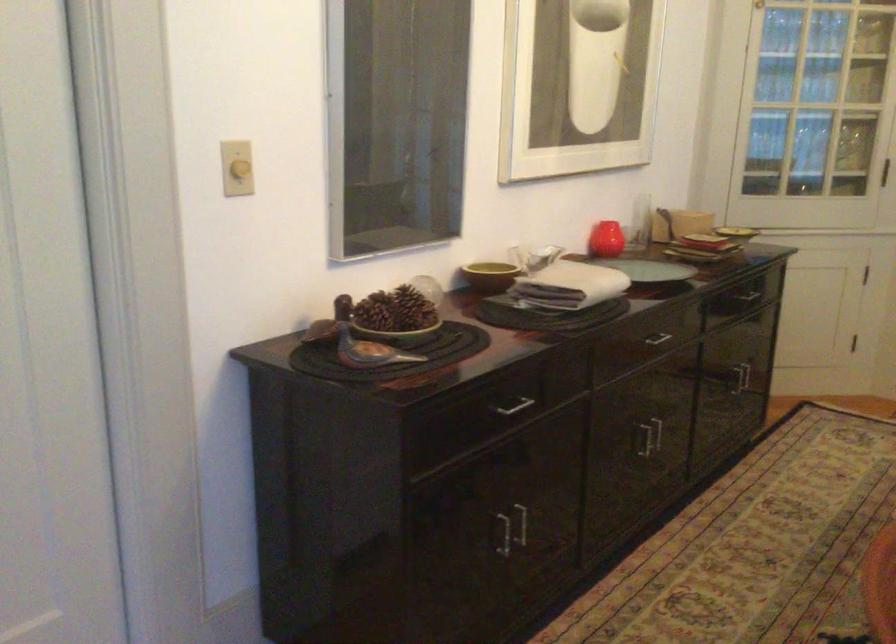
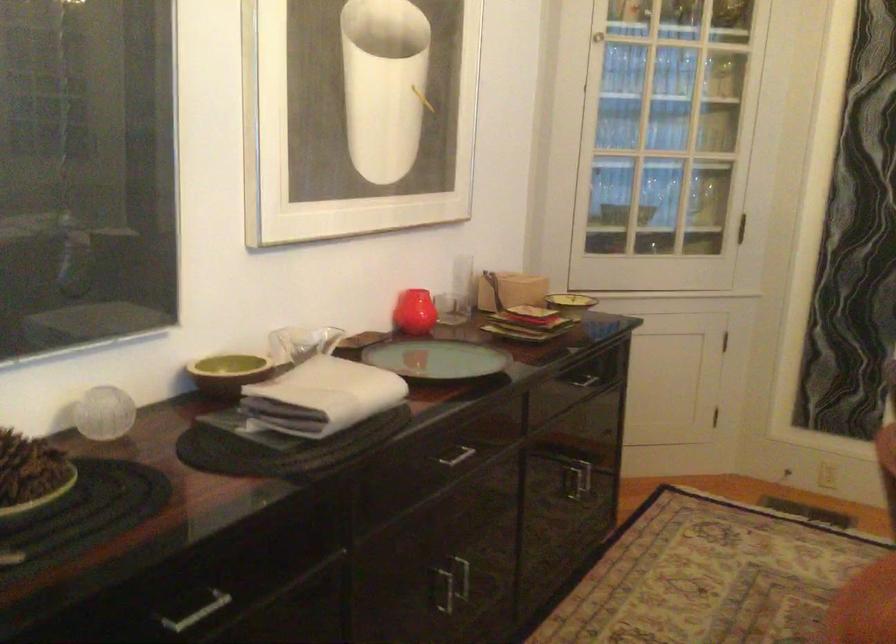
Which direction would the cameraman need to move to produce the second image?

The cameraman walked toward right, forward.